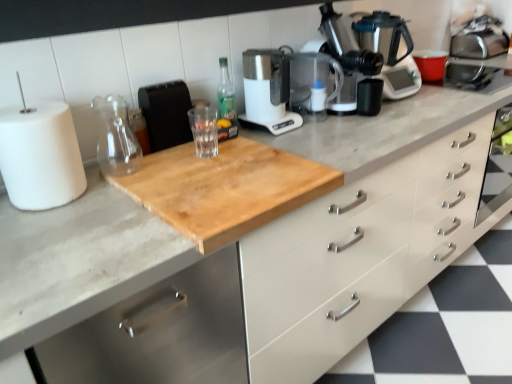
Question: Is white matte drawer at center at the right side of metallic silver coffee machine at upper right?

Choices:
 (A) no
 (B) yes

Answer: (B)

Question: From a real-world perspective, is white matte drawer at center physically below metallic silver coffee machine at upper right?

Choices:
 (A) no
 (B) yes

Answer: (B)

Question: Is white matte drawer at center surrounding metallic silver coffee machine at upper right?

Choices:
 (A) no
 (B) yes

Answer: (A)

Question: Would you say white matte drawer at center is outside metallic silver coffee machine at upper right?

Choices:
 (A) yes
 (B) no

Answer: (A)

Question: Is white matte drawer at center wider than metallic silver coffee machine at upper right?

Choices:
 (A) no
 (B) yes

Answer: (B)

Question: From a real-world perspective, is white matte drawer at center positioned over metallic silver coffee machine at upper right based on gravity?

Choices:
 (A) no
 (B) yes

Answer: (A)

Question: Does transparent glass at center, the first glass jar from the right, appear on the right side of satin silver coffee pot at upper right?

Choices:
 (A) no
 (B) yes

Answer: (A)

Question: Could you tell me if transparent glass at center, the first glass jar from the right, is facing satin silver coffee pot at upper right?

Choices:
 (A) no
 (B) yes

Answer: (A)

Question: Is transparent glass at center, the first glass jar from the right, closer to the viewer compared to satin silver coffee pot at upper right?

Choices:
 (A) yes
 (B) no

Answer: (A)

Question: Is transparent glass at center, the first glass jar from the right, positioned with its back to satin silver coffee pot at upper right?

Choices:
 (A) yes
 (B) no

Answer: (B)

Question: Considering the relative sizes of transparent glass at center, the 2th glass jar when ordered from left to right, and satin silver coffee pot at upper right in the image provided, is transparent glass at center, the 2th glass jar when ordered from left to right, shorter than satin silver coffee pot at upper right?

Choices:
 (A) no
 (B) yes

Answer: (B)

Question: From the image's perspective, would you say transparent glass at center, the first glass jar from the right, is shown under satin silver coffee pot at upper right?

Choices:
 (A) no
 (B) yes

Answer: (B)

Question: From the image's perspective, would you say white matte drawer at center is shown under transparent glass jar at upper center, the 1th glass jar positioned from the left?

Choices:
 (A) no
 (B) yes

Answer: (B)